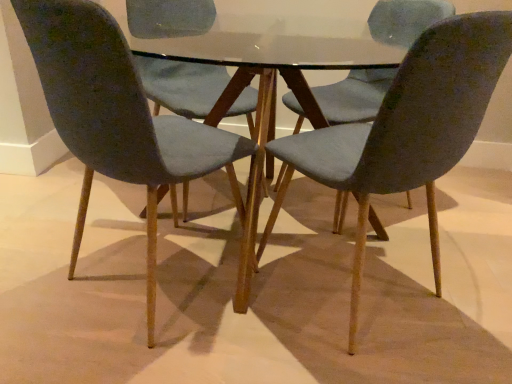
Question: From the image's perspective, relative to matte blue chair at center, placed as the third chair when sorted from left to right, is velvet blue chair at center, which appears as the second chair when viewed from the left, above or below?

Choices:
 (A) below
 (B) above

Answer: (B)

Question: Looking at their shapes, would you say velvet blue chair at center, which appears as the second chair when viewed from the left, is wider or thinner than matte blue chair at center, placed as the third chair when sorted from left to right?

Choices:
 (A) wide
 (B) thin

Answer: (B)

Question: Estimate the real-world distances between objects in this image. Which object is farther from the glass table at center?

Choices:
 (A) matte gray chair at left, which appears as the 3th chair when viewed from the right
 (B) matte blue chair at center, which is the first chair from right to left
 (C) velvet blue chair at center, the 2th chair from the right

Answer: (A)

Question: Which object is positioned closest to the matte gray chair at left, which appears as the 3th chair when viewed from the right?

Choices:
 (A) glass table at center
 (B) matte blue chair at center, placed as the third chair when sorted from left to right
 (C) velvet blue chair at center, which appears as the second chair when viewed from the left

Answer: (C)